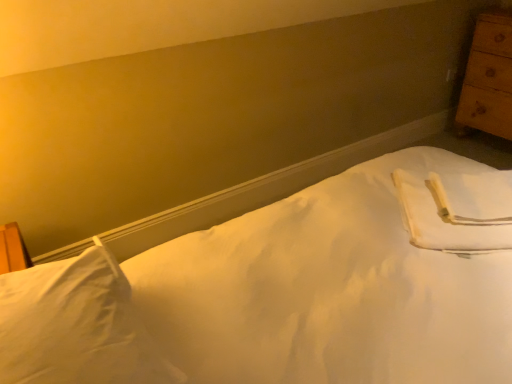
Question: Can you confirm if white smooth bed at center is smaller than white soft pillow at lower left?

Choices:
 (A) yes
 (B) no

Answer: (B)

Question: Is white smooth bed at center in front of white soft pillow at lower left?

Choices:
 (A) yes
 (B) no

Answer: (A)

Question: Is white smooth bed at center at the right side of white soft pillow at lower left?

Choices:
 (A) no
 (B) yes

Answer: (B)

Question: Considering the relative sizes of white smooth bed at center and white soft pillow at lower left in the image provided, is white smooth bed at center bigger than white soft pillow at lower left?

Choices:
 (A) yes
 (B) no

Answer: (A)

Question: From the image's perspective, would you say white smooth bed at center is positioned over white soft pillow at lower left?

Choices:
 (A) no
 (B) yes

Answer: (A)

Question: Is white soft pillow at lower left a part of white smooth bed at center?

Choices:
 (A) yes
 (B) no

Answer: (A)

Question: Can you confirm if white smooth bed at center is thinner than wooden chest of drawers at right?

Choices:
 (A) yes
 (B) no

Answer: (B)

Question: Considering the relative sizes of white smooth bed at center and wooden chest of drawers at right in the image provided, is white smooth bed at center wider than wooden chest of drawers at right?

Choices:
 (A) yes
 (B) no

Answer: (A)

Question: Can you confirm if white smooth bed at center is positioned to the right of wooden chest of drawers at right?

Choices:
 (A) yes
 (B) no

Answer: (B)

Question: Is white smooth bed at center smaller than wooden chest of drawers at right?

Choices:
 (A) no
 (B) yes

Answer: (A)

Question: From a real-world perspective, does white smooth bed at center stand above wooden chest of drawers at right?

Choices:
 (A) yes
 (B) no

Answer: (B)

Question: Does white smooth bed at center turn towards wooden chest of drawers at right?

Choices:
 (A) no
 (B) yes

Answer: (B)

Question: Is white soft pillow at lower left wider than wooden chest of drawers at right?

Choices:
 (A) no
 (B) yes

Answer: (B)